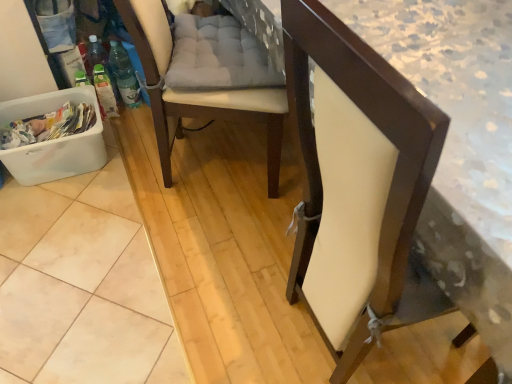
The width and height of the screenshot is (512, 384). Find the location of `vacant space to the left of white leather chair at center, which is the first chair from left to right`. vacant space to the left of white leather chair at center, which is the first chair from left to right is located at coordinates (103, 182).